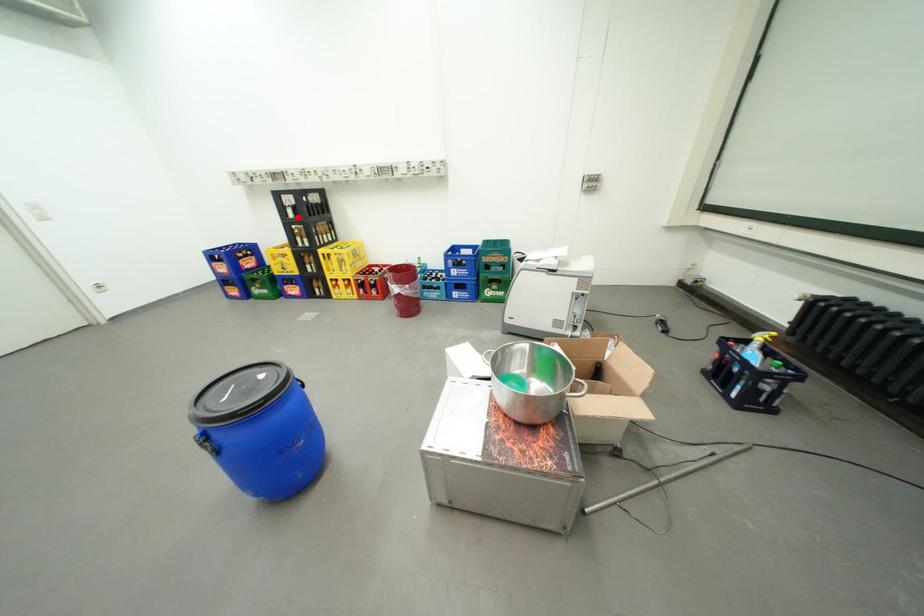
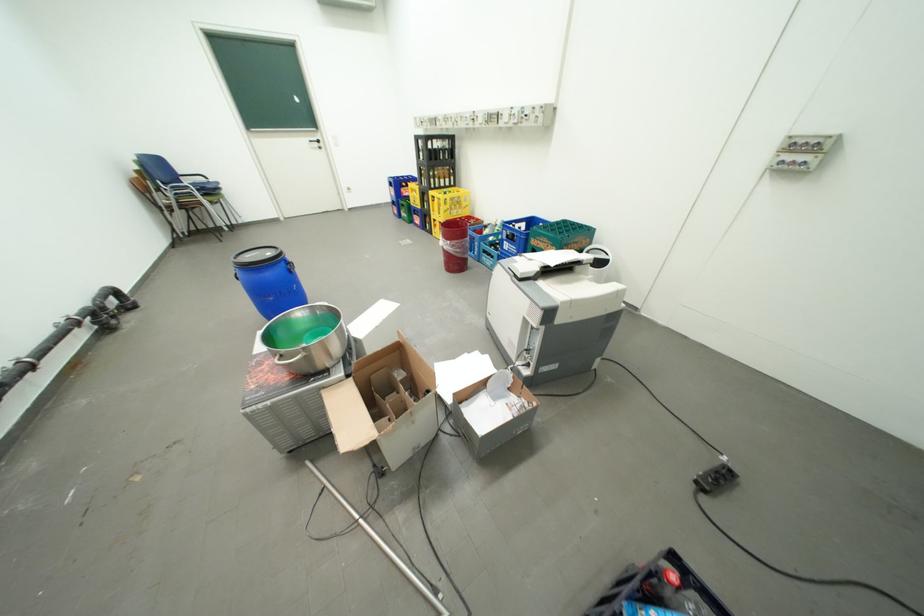
Question: A red point is marked in image1. In image2, is the corresponding 3D point closer to the camera or farther? Reply with the corresponding letter.

Choices:
 (A) The corresponding 3D point is closer.
 (B) The corresponding 3D point is farther.

Answer: (A)